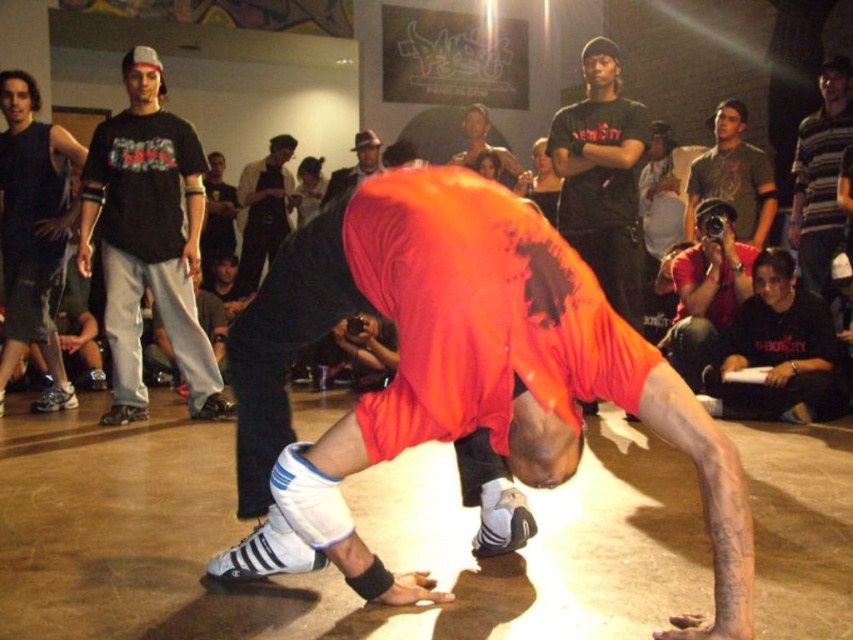
Between point (206, 269) and point (514, 179), which one is positioned behind?

Positioned behind is point (206, 269).

Which is above, black cotton shirt at center or orange fabric shirt at center?

orange fabric shirt at center is higher up.

Locate an element on the screen. black cotton shirt at center is located at coordinates (218, 216).

Can you confirm if matte black t-shirt at left is positioned to the left of matte black camera at lower right?

Indeed, matte black t-shirt at left is positioned on the left side of matte black camera at lower right.

Based on the photo, is matte black t-shirt at left below matte black camera at lower right?

Incorrect, matte black t-shirt at left is not positioned below matte black camera at lower right.

Locate an element on the screen. This screenshot has height=640, width=853. matte black t-shirt at left is located at coordinates coord(148,240).

At what (x,y) coordinates should I click in order to perform the action: click on matte black t-shirt at left. Please return your answer as a coordinate pair (x, y). This screenshot has width=853, height=640. Looking at the image, I should click on (148, 240).

Can you confirm if black cotton shirt at center is taller than smooth leather hat at upper center?

Yes, black cotton shirt at center is taller than smooth leather hat at upper center.

Which is in front, point (210, 164) or point (334, 189)?

Point (334, 189) is more forward.

Where is `black cotton shirt at center`? The image size is (853, 640). black cotton shirt at center is located at coordinates (218, 216).